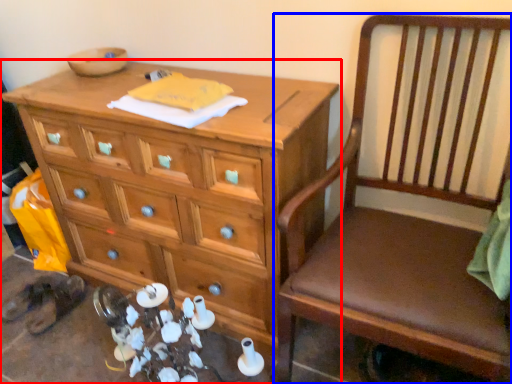
Question: Which point is further to the camera, chest of drawers (highlighted by a red box) or chair (highlighted by a blue box)?

Choices:
 (A) chest of drawers
 (B) chair

Answer: (A)